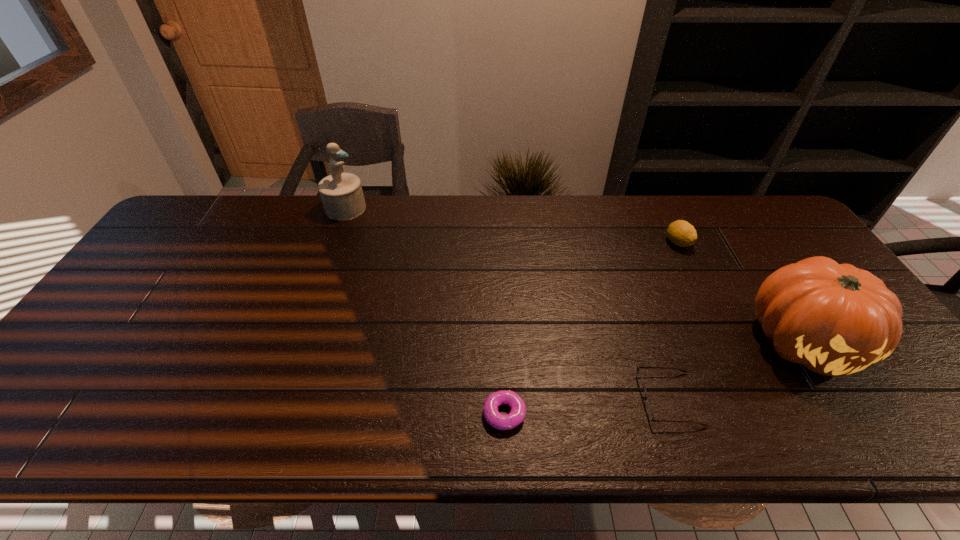
Identify the location of vacant space that is in between the third object from right to left and the third shortest object. The image size is (960, 540). (674, 320).

Image resolution: width=960 pixels, height=540 pixels. Identify the location of vacant space in between the spectacles and the figurine. (507, 303).

Choose which object is the third nearest neighbor to the fourth object from right to left. Please provide its 2D coordinates. Your answer should be formatted as a tuple, i.e. [(x, y)], where the tuple contains the x and y coordinates of a point satisfying the conditions above.

[(681, 233)]

What are the coordinates of `object that is the second closest to the figurine` in the screenshot? It's located at (648, 407).

Locate an element on the screen. Image resolution: width=960 pixels, height=540 pixels. free region that satisfies the following two spatial constraints: 1. at the beak of the leftmost object; 2. on the back side of the fourth object from right to left is located at coordinates (272, 414).

Locate an element on the screen. This screenshot has width=960, height=540. free location that satisfies the following two spatial constraints: 1. at the beak of the leftmost object; 2. on the left side of the second object from left to right is located at coordinates (272, 414).

Locate an element on the screen. The image size is (960, 540). blank space that satisfies the following two spatial constraints: 1. at the stem end of the second object from right to left; 2. on the front-facing side of the third object from right to left is located at coordinates (754, 399).

Where is `vacant space that satisfies the following two spatial constraints: 1. at the stem end of the lemon; 2. on the front-facing side of the spectacles`? vacant space that satisfies the following two spatial constraints: 1. at the stem end of the lemon; 2. on the front-facing side of the spectacles is located at coordinates (754, 399).

Find the location of `free space that satisfies the following two spatial constraints: 1. at the beak of the farthest object; 2. on the right side of the second object from left to right`. free space that satisfies the following two spatial constraints: 1. at the beak of the farthest object; 2. on the right side of the second object from left to right is located at coordinates pos(272,414).